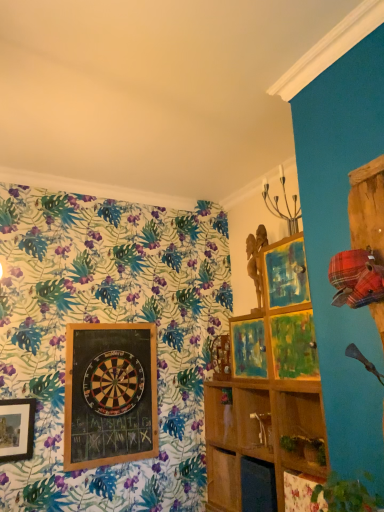
Question: From the image's perspective, does wooden shelf at center, arranged as the second shelf when viewed from the front, appear higher than wooden dartboard at center?

Choices:
 (A) yes
 (B) no

Answer: (B)

Question: Is wooden shelf at center, which is counted as the 1th shelf, starting from the back, thinner than wooden dartboard at center?

Choices:
 (A) yes
 (B) no

Answer: (B)

Question: Is the depth of wooden shelf at center, arranged as the second shelf when viewed from the front, greater than that of wooden dartboard at center?

Choices:
 (A) no
 (B) yes

Answer: (B)

Question: Can you confirm if wooden shelf at center, which is counted as the 1th shelf, starting from the back, is smaller than wooden dartboard at center?

Choices:
 (A) no
 (B) yes

Answer: (B)

Question: Is wooden shelf at center, arranged as the second shelf when viewed from the front, to the right of wooden dartboard at center from the viewer's perspective?

Choices:
 (A) no
 (B) yes

Answer: (B)

Question: Would you say wooden dartboard at center-left is to the left or to the right of wooden shelf at center, which ranks as the second shelf in back-to-front order, in the picture?

Choices:
 (A) left
 (B) right

Answer: (A)

Question: Considering the positions of point (132, 390) and point (243, 455), is point (132, 390) closer or farther from the camera than point (243, 455)?

Choices:
 (A) closer
 (B) farther

Answer: (B)

Question: From a real-world perspective, is wooden dartboard at center-left physically located above or below wooden shelf at center, which ranks as the second shelf in back-to-front order?

Choices:
 (A) above
 (B) below

Answer: (A)

Question: Is wooden dartboard at center-left wider or thinner than wooden shelf at center, arranged as the first shelf when viewed from the front?

Choices:
 (A) thin
 (B) wide

Answer: (A)

Question: Is wooden shelf at center, which is counted as the 1th shelf, starting from the back, taller or shorter than wooden dartboard at center?

Choices:
 (A) tall
 (B) short

Answer: (B)

Question: From a real-world perspective, is wooden shelf at center, which is counted as the 1th shelf, starting from the back, positioned above or below wooden dartboard at center?

Choices:
 (A) below
 (B) above

Answer: (A)

Question: Is wooden shelf at center, which is counted as the 1th shelf, starting from the back, situated inside wooden dartboard at center or outside?

Choices:
 (A) outside
 (B) inside

Answer: (A)

Question: Considering the positions of point (225, 397) and point (120, 379), is point (225, 397) closer or farther from the camera than point (120, 379)?

Choices:
 (A) closer
 (B) farther

Answer: (A)

Question: Considering the positions of wooden shelf at center, which ranks as the second shelf in back-to-front order, and wooden dartboard at center-left in the image, is wooden shelf at center, which ranks as the second shelf in back-to-front order, bigger or smaller than wooden dartboard at center-left?

Choices:
 (A) big
 (B) small

Answer: (A)

Question: Is wooden shelf at center, arranged as the first shelf when viewed from the front, wider or thinner than wooden dartboard at center-left?

Choices:
 (A) wide
 (B) thin

Answer: (A)